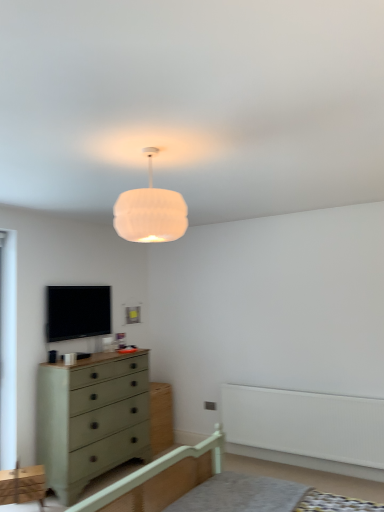
Question: Is black glossy tv at upper left wider than white fabric lampshade at upper center?

Choices:
 (A) no
 (B) yes

Answer: (A)

Question: Can you confirm if black glossy tv at upper left is positioned to the right of white fabric lampshade at upper center?

Choices:
 (A) yes
 (B) no

Answer: (B)

Question: Is black glossy tv at upper left positioned behind white fabric lampshade at upper center?

Choices:
 (A) no
 (B) yes

Answer: (B)

Question: Is the surface of black glossy tv at upper left in direct contact with white fabric lampshade at upper center?

Choices:
 (A) yes
 (B) no

Answer: (B)

Question: Could you tell me if black glossy tv at upper left is turned towards white fabric lampshade at upper center?

Choices:
 (A) yes
 (B) no

Answer: (A)

Question: In the image, is white fabric lampshade at upper center on the left side or the right side of white painted wood bed frame at center?

Choices:
 (A) left
 (B) right

Answer: (A)

Question: In terms of width, does white fabric lampshade at upper center look wider or thinner when compared to white painted wood bed frame at center?

Choices:
 (A) wide
 (B) thin

Answer: (B)

Question: Does point (148, 224) appear closer or farther from the camera than point (185, 464)?

Choices:
 (A) closer
 (B) farther

Answer: (A)

Question: In terms of height, does white fabric lampshade at upper center look taller or shorter compared to white painted wood bed frame at center?

Choices:
 (A) short
 (B) tall

Answer: (A)

Question: Looking at their shapes, would you say green matte cabinet at lower left is wider or thinner than white painted wood bed frame at center?

Choices:
 (A) thin
 (B) wide

Answer: (A)

Question: Considering the positions of green matte cabinet at lower left and white painted wood bed frame at center in the image, is green matte cabinet at lower left bigger or smaller than white painted wood bed frame at center?

Choices:
 (A) small
 (B) big

Answer: (A)

Question: Would you say green matte cabinet at lower left is inside or outside white painted wood bed frame at center?

Choices:
 (A) inside
 (B) outside

Answer: (B)

Question: From a real-world perspective, is green matte cabinet at lower left above or below white painted wood bed frame at center?

Choices:
 (A) below
 (B) above

Answer: (A)

Question: Which is correct: white painted wood bed frame at center is inside white plastic balustrade at lower right, or outside of it?

Choices:
 (A) outside
 (B) inside

Answer: (A)

Question: Is white painted wood bed frame at center wider or thinner than white plastic balustrade at lower right?

Choices:
 (A) wide
 (B) thin

Answer: (A)